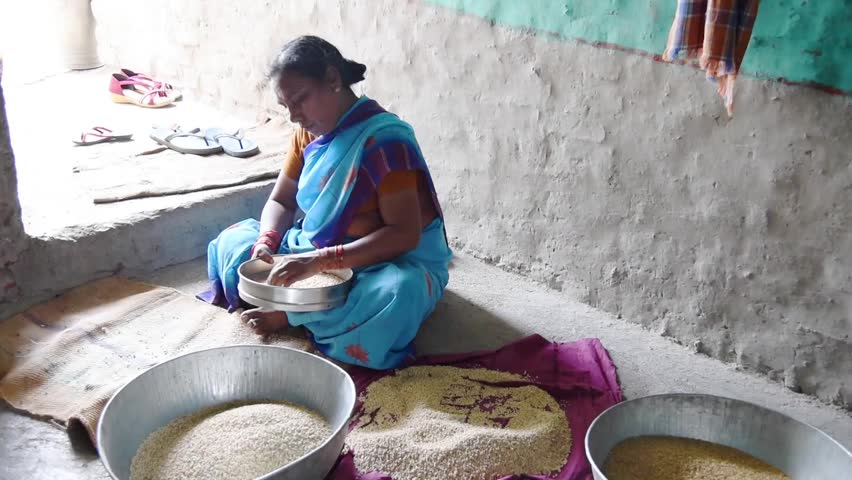
Identify the location of multi colored hanging blanket. This screenshot has height=480, width=852. (728, 38).